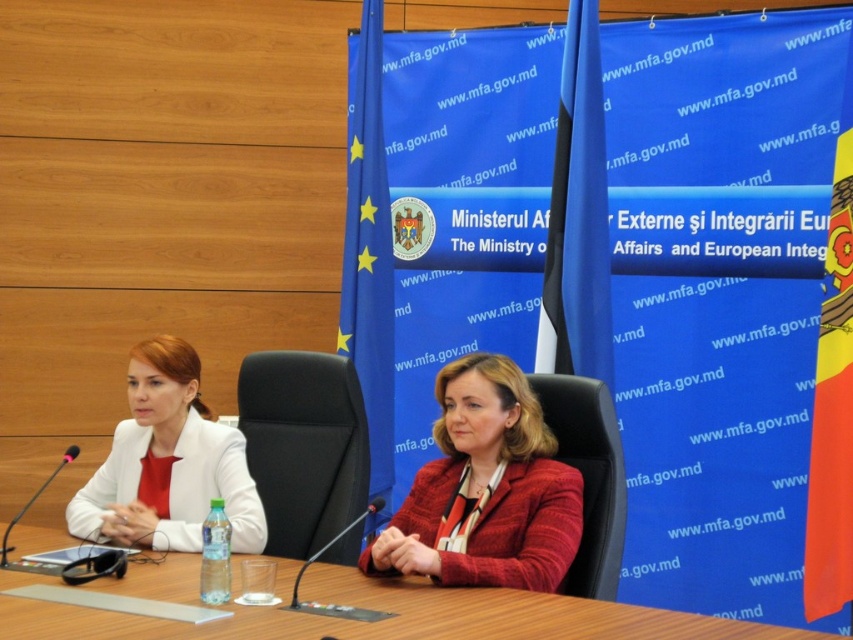
You are standing in front of the press conference setup and want to place a small flower vase exactly at the point marked as point [792,632]. If your arm can reach up to 2 meters, can you place the vase without moving closer?

The distance of point [792,632] from the camera is 2.30 meters. Since your arm can only reach up to 2 meters, you cannot place the vase at that point without moving closer.

Looking at this image, you are attending a virtual meeting and need to identify the speaker based on their clothing. The speaker is wearing a matte red blazer at center and a matte white blazer at left. Which blazer is positioned lower on the screen?

The matte red blazer at center is positioned lower on the screen compared to the matte white blazer at left.